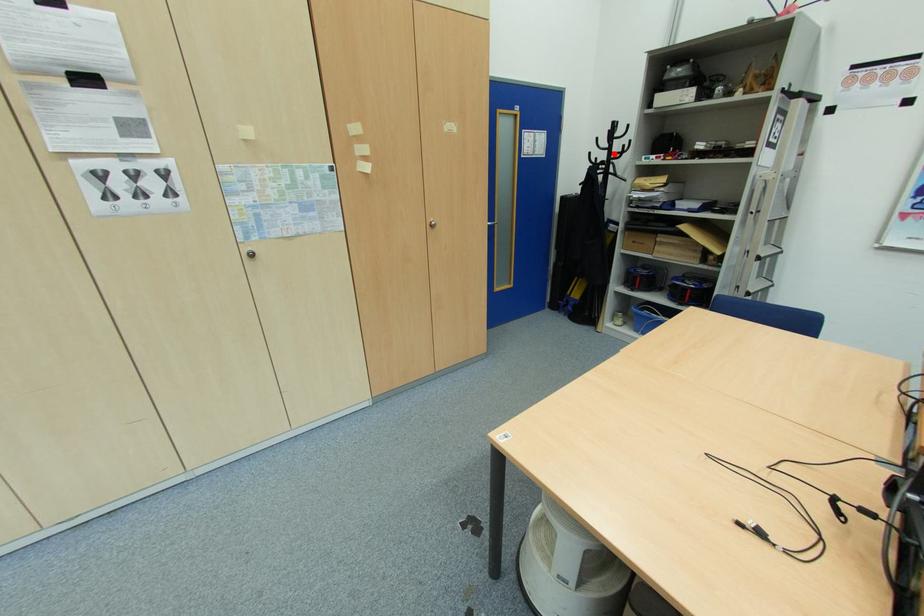
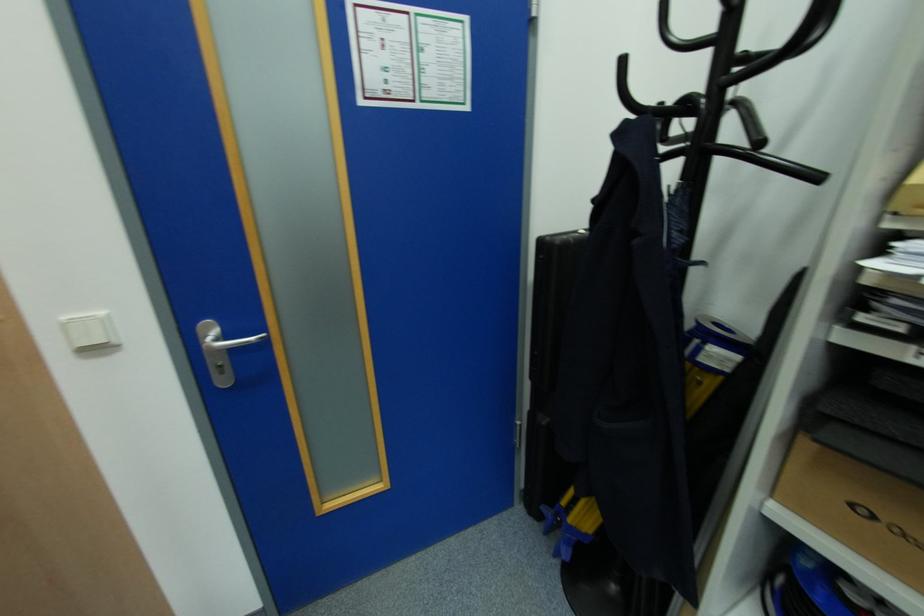
Question: I am providing you with two images of the same scene from different viewpoints. A red point is marked on the first image. At the location where the point appears in image 1, is it still visible in image 2?

Choices:
 (A) Yes
 (B) No

Answer: (A)